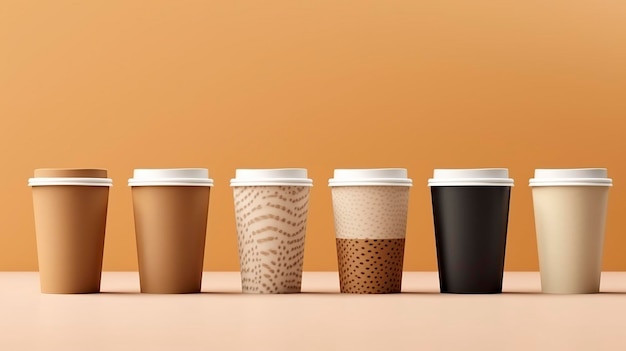
Where is `coffee cup`? The image size is (626, 351). coffee cup is located at coordinates (74, 251), (171, 235), (265, 239), (362, 233), (467, 240), (551, 247).